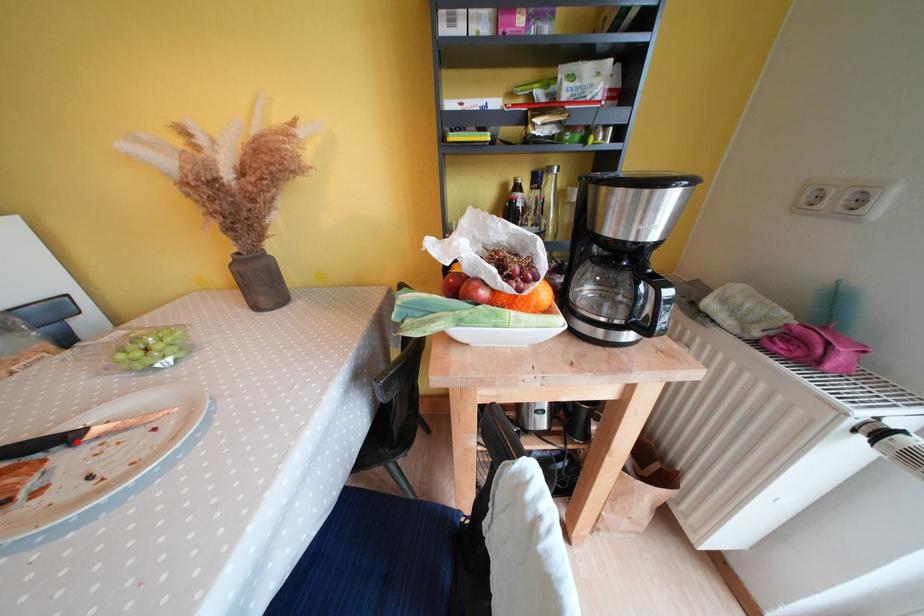
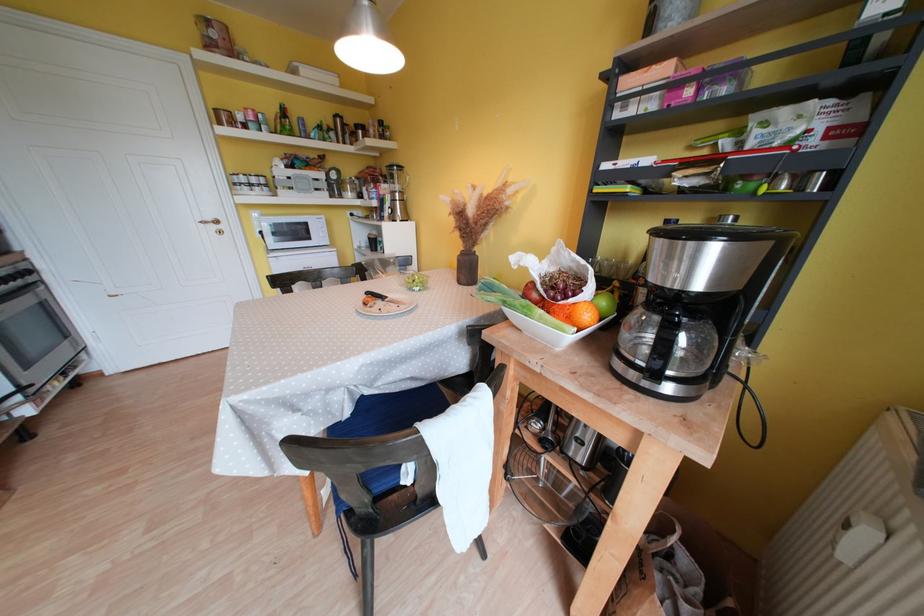
Where in the second image is the point corresponding to the highlighted location from the first image?

(390, 301)